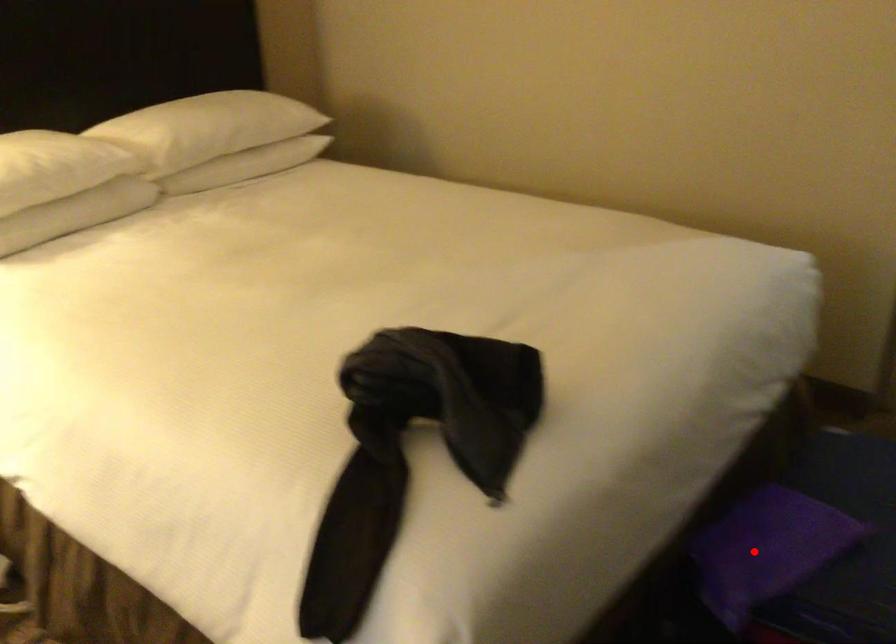
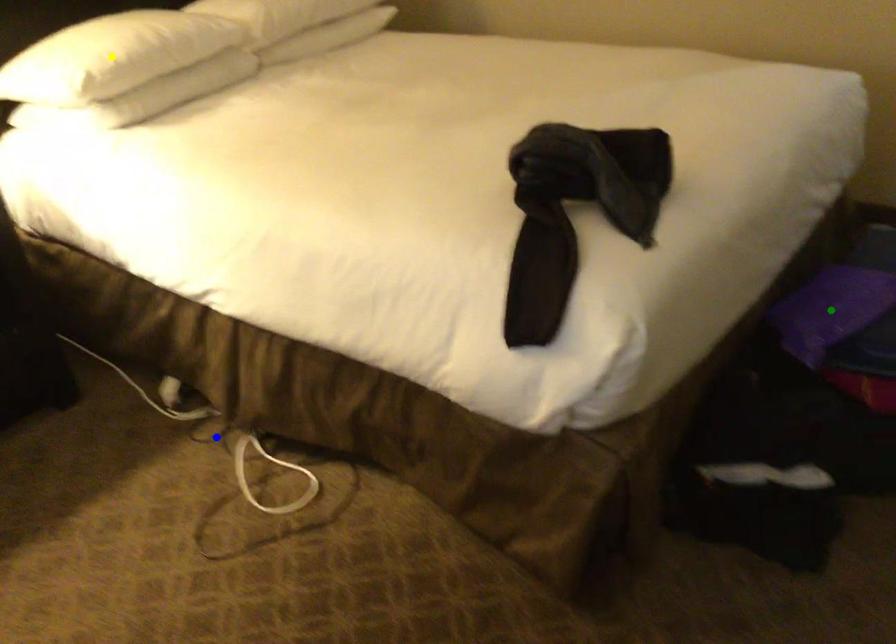
Question: I am providing you with two images of the same scene from different viewpoints. A red point is marked on the first image. You are given multiple points on the second image. Which point in image 2 represents the same 3d spot as the red point in image 1?

Choices:
 (A) yellow point
 (B) blue point
 (C) green point

Answer: (C)